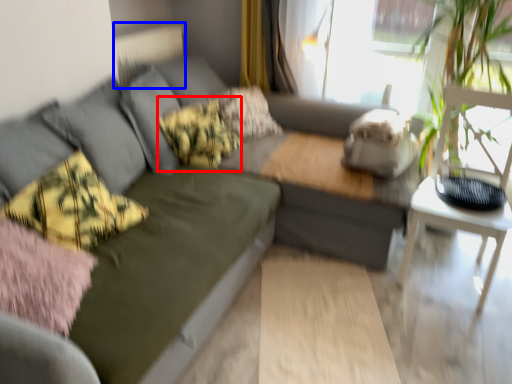
Question: Among these objects, which one is nearest to the camera, pillow (highlighted by a red box) or radiator (highlighted by a blue box)?

Choices:
 (A) pillow
 (B) radiator

Answer: (A)